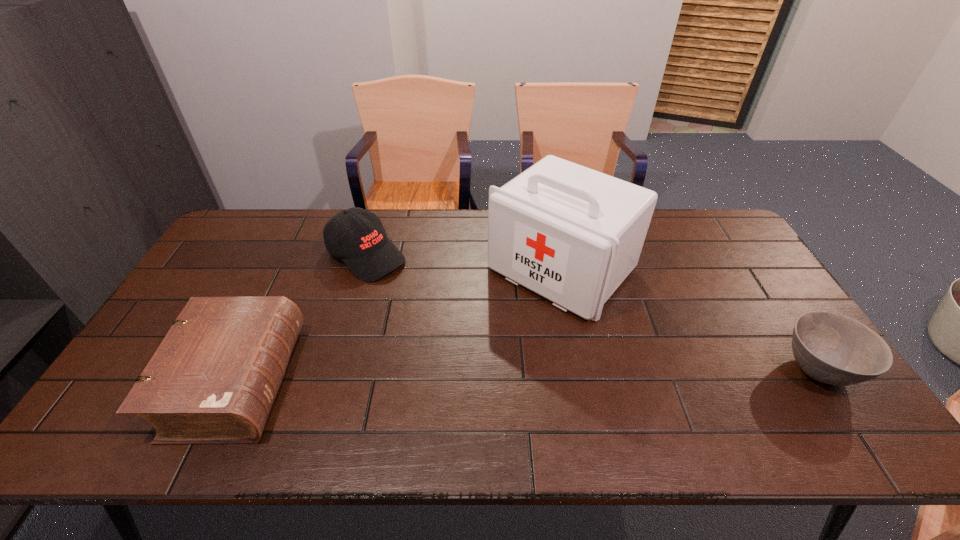
Where is `Bible`? The height and width of the screenshot is (540, 960). Bible is located at coordinates (213, 380).

The image size is (960, 540). In order to click on the shortest object in this screenshot , I will do `click(831, 348)`.

Locate an element on the screen. Image resolution: width=960 pixels, height=540 pixels. bowl is located at coordinates (831, 348).

The width and height of the screenshot is (960, 540). Find the location of `baseball cap`. baseball cap is located at coordinates (357, 236).

Identify the location of the first-aid kit. The height and width of the screenshot is (540, 960). click(571, 234).

Locate an element on the screen. The image size is (960, 540). the third object from left to right is located at coordinates click(x=571, y=234).

The image size is (960, 540). I want to click on free region located 0.200m on the spine side of the Bible, so click(x=371, y=382).

I want to click on vacant area situated 0.080m on the back of the bowl, so click(783, 317).

I want to click on free space located on the front-facing side of the baseball cap, so click(x=480, y=335).

You are a GUI agent. You are given a task and a screenshot of the screen. Output one action in this format:
    pyautogui.click(x=<x>, y=<y>)
    Task: Click on the vacant space located on the front-facing side of the baseball cap
    
    Given the screenshot: What is the action you would take?
    pyautogui.click(x=446, y=311)